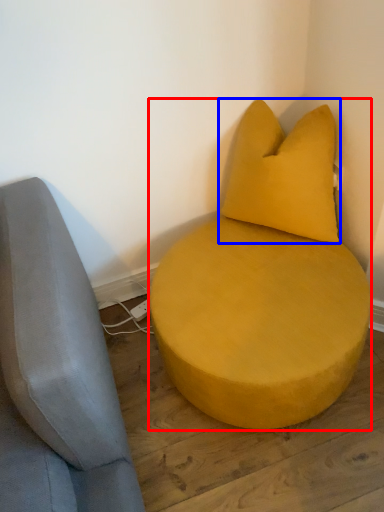
Question: Which object appears farthest to the camera in this image, furniture (highlighted by a red box) or pillow (highlighted by a blue box)?

Choices:
 (A) furniture
 (B) pillow

Answer: (B)